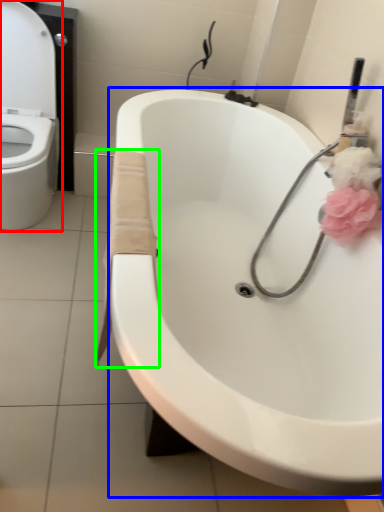
Question: Which object is positioned closest to toilet (highlighted by a red box)? Select from sink (highlighted by a blue box) and material (highlighted by a green box).

Choices:
 (A) sink
 (B) material

Answer: (A)